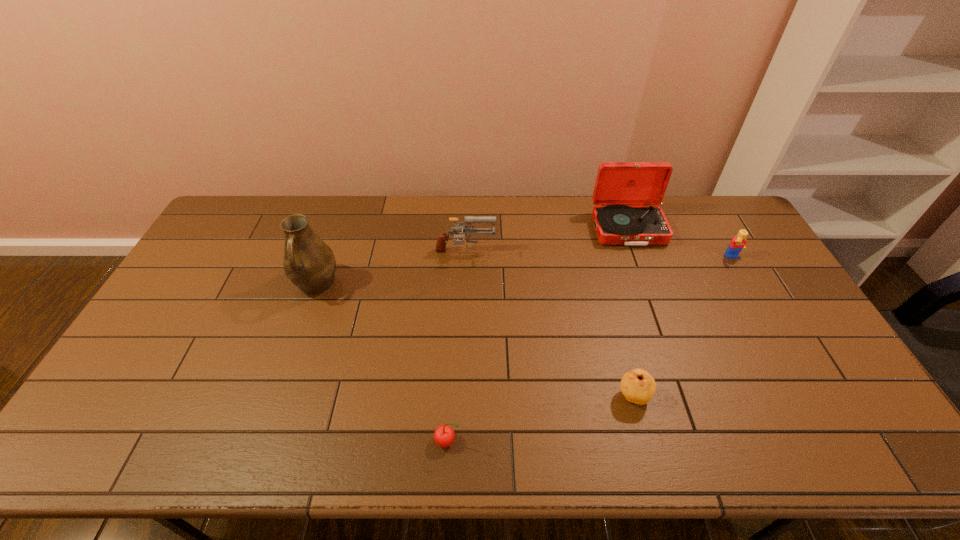
Where is `free location that satisfies the following two spatial constraints: 1. at the barrel end of the fourth shortest object; 2. on the handle side of the pitcher`? free location that satisfies the following two spatial constraints: 1. at the barrel end of the fourth shortest object; 2. on the handle side of the pitcher is located at coordinates (465, 285).

Identify the location of vacant area that satisfies the following two spatial constraints: 1. at the barrel end of the gun; 2. on the back side of the pear. Image resolution: width=960 pixels, height=540 pixels. (461, 396).

You are a GUI agent. You are given a task and a screenshot of the screen. Output one action in this format:
    pyautogui.click(x=<x>, y=<y>)
    Task: Click on the free location that satisfies the following two spatial constraints: 1. on the back side of the pear; 2. on the left side of the nearest object
    The image size is (960, 540).
    Given the screenshot: What is the action you would take?
    pyautogui.click(x=450, y=396)

Locate an element on the screen. free spot that satisfies the following two spatial constraints: 1. at the barrel end of the fourth shortest object; 2. on the handle side of the leftmost object is located at coordinates (465, 285).